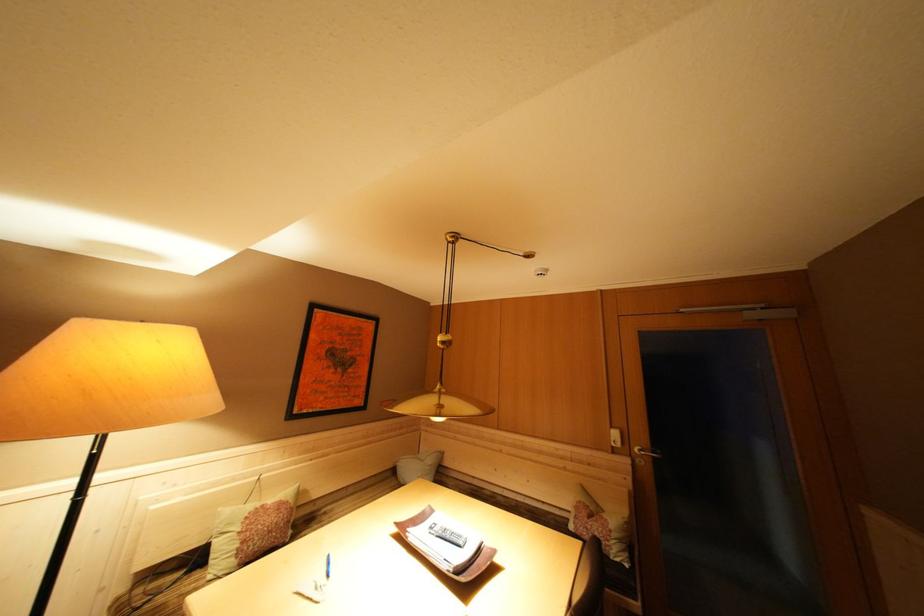
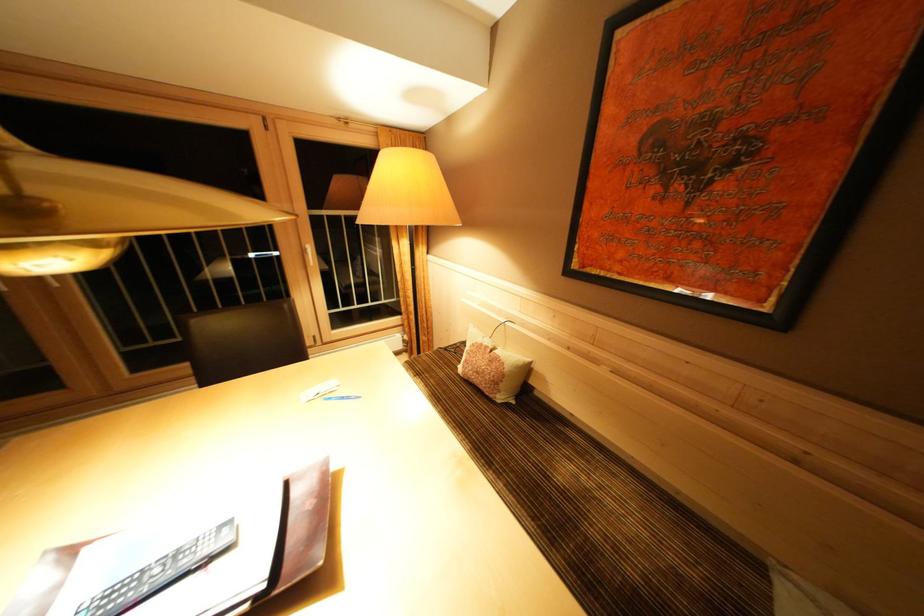
Locate, in the second image, the point that corresponds to the point at 333,517 in the first image.

(565, 438)